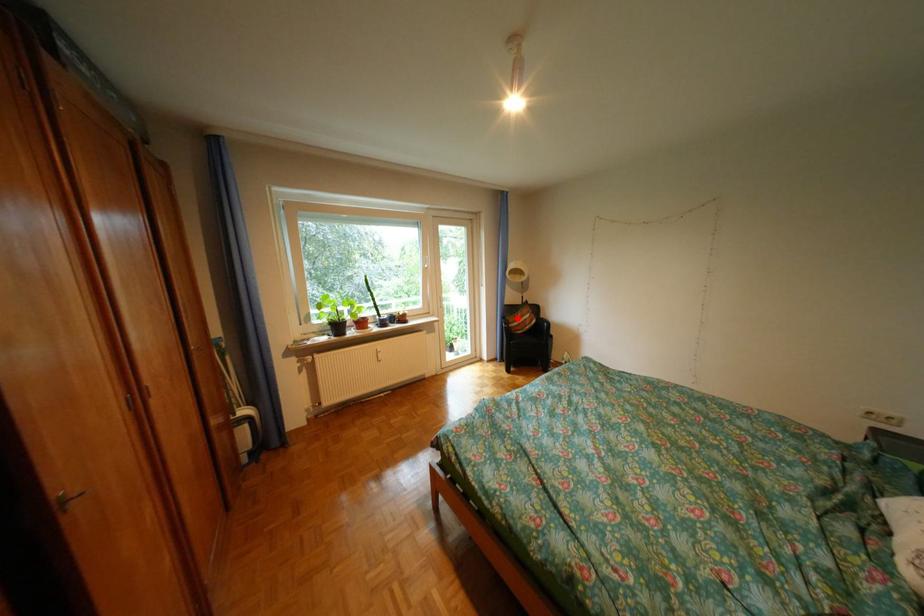
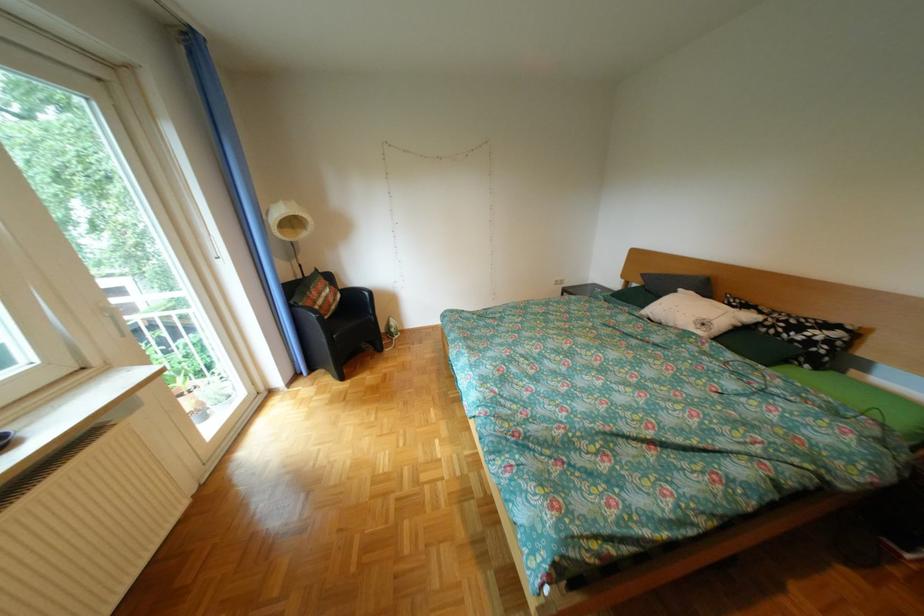
The point at the highlighted location is marked in the first image. Where is the corresponding point in the second image?

(306, 307)